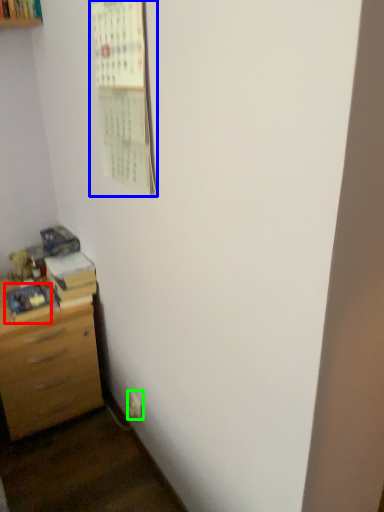
Question: Considering the real-world distances, which object is farthest from book (highlighted by a red box)? bulletin board (highlighted by a blue box) or electric outlet (highlighted by a green box)?

Choices:
 (A) bulletin board
 (B) electric outlet

Answer: (A)